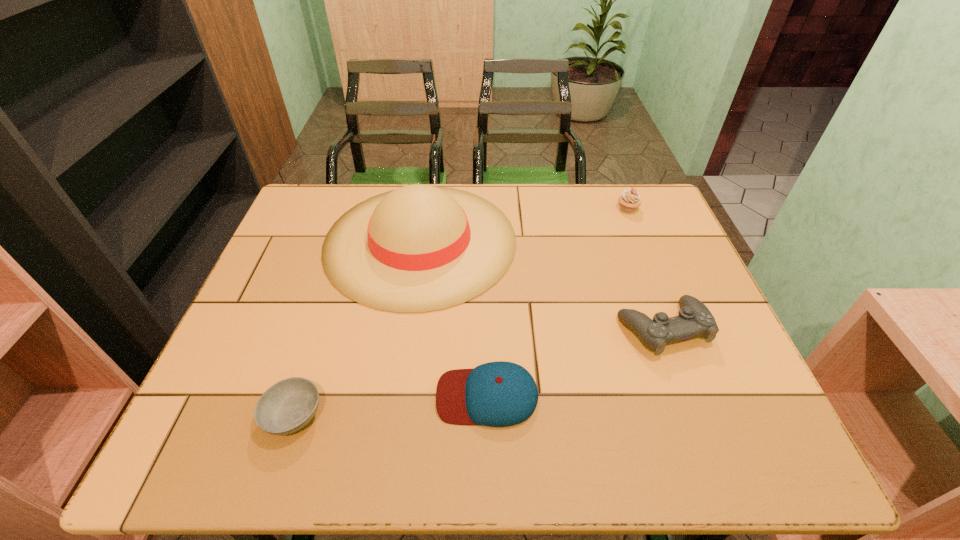
I want to click on free area in between the sombrero and the shortest object, so click(x=357, y=328).

This screenshot has width=960, height=540. What are the coordinates of `vacant space that's between the cupcake and the baseball cap` in the screenshot? It's located at [x=558, y=302].

The image size is (960, 540). I want to click on vacant area between the shortest object and the cupcake, so click(x=461, y=312).

The height and width of the screenshot is (540, 960). Find the location of `free area in between the baseball cap and the shortest object`. free area in between the baseball cap and the shortest object is located at coordinates coord(391,406).

This screenshot has width=960, height=540. I want to click on empty space between the baseball cap and the shortest object, so click(391, 406).

Identify the location of free space that is in between the cupcake and the control. The image size is (960, 540). (645, 268).

Locate an element on the screen. This screenshot has width=960, height=540. vacant space that's between the tallest object and the shortest object is located at coordinates (357, 328).

You are a GUI agent. You are given a task and a screenshot of the screen. Output one action in this format:
    pyautogui.click(x=<x>, y=<y>)
    Task: Click on the empty location between the tallest object and the baseball cap
    This screenshot has width=960, height=540.
    Given the screenshot: What is the action you would take?
    pyautogui.click(x=454, y=319)

Image resolution: width=960 pixels, height=540 pixels. What are the coordinates of `object that is the fourth closest to the baseball cap` in the screenshot? It's located at (630, 199).

Identify the location of object that stands as the closest to the baseball cap. The image size is (960, 540). (419, 248).